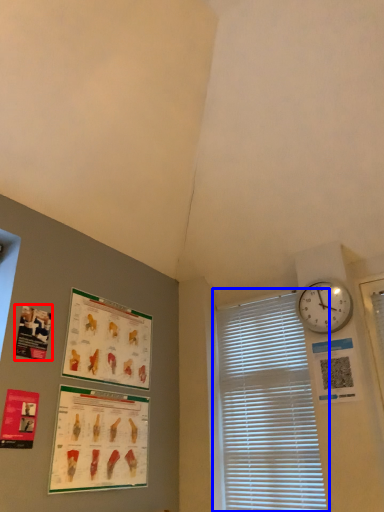
Question: Which object appears closest to the camera in this image, poster page (highlighted by a red box) or window blind (highlighted by a blue box)?

Choices:
 (A) poster page
 (B) window blind

Answer: (A)